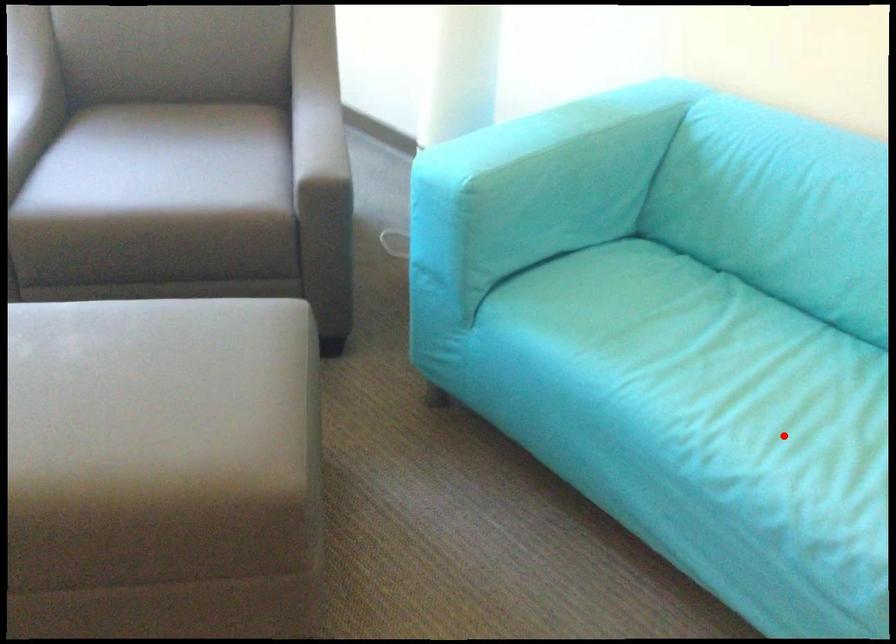
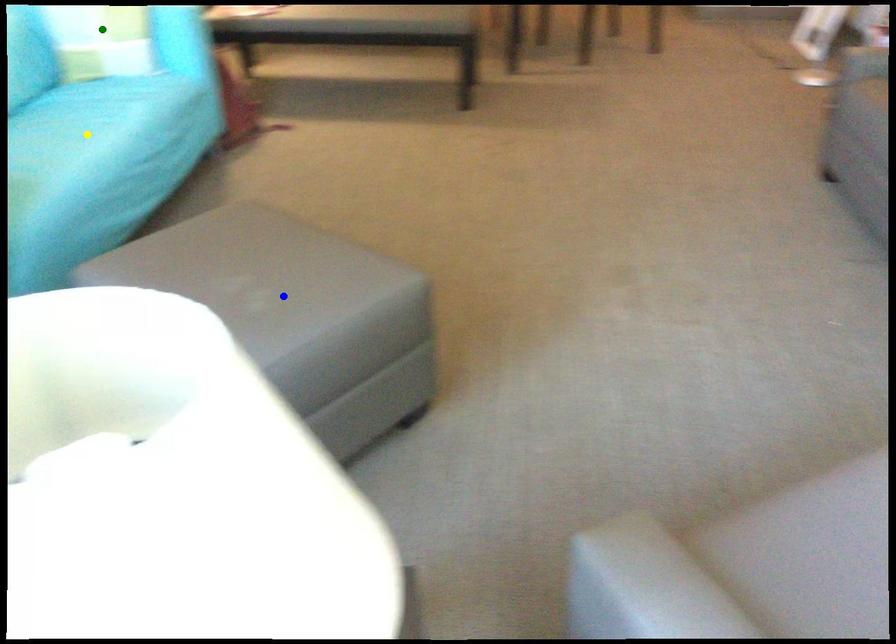
Question: I am providing you with two images of the same scene from different viewpoints. A red point is marked on the first image. You are given multiple points on the second image. Which point in image 2 is actually the same real-world point as the red point in image 1?

Choices:
 (A) yellow point
 (B) green point
 (C) blue point

Answer: (A)